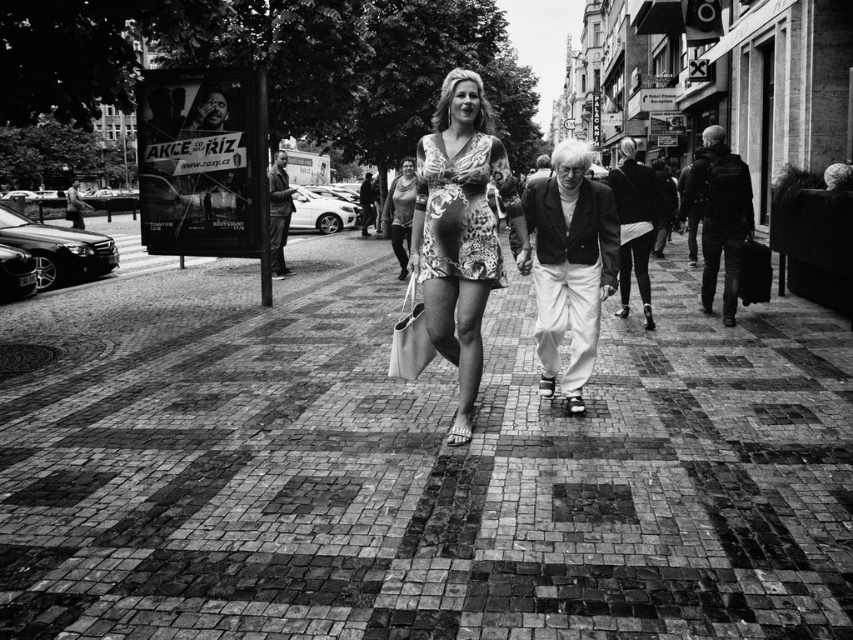
Is white cotton pants at center closer to the viewer compared to leopard print dress at center?

No, it is behind leopard print dress at center.

Who is lower down, white cotton pants at center or leopard print dress at center?

leopard print dress at center is below.

Which is behind, point (614, 282) or point (486, 200)?

The point (614, 282) is more distant.

Find the location of `white cotton pants at center`. white cotton pants at center is located at coordinates (570, 264).

Can you confirm if brick pavement at center is positioned to the right of matte beige fabric shopping bag at center?

In fact, brick pavement at center is to the left of matte beige fabric shopping bag at center.

Is brick pavement at center wider than matte beige fabric shopping bag at center?

Yes.

You are a GUI agent. You are given a task and a screenshot of the screen. Output one action in this format:
    pyautogui.click(x=<x>, y=<y>)
    Task: Click on the brick pavement at center
    The width and height of the screenshot is (853, 640).
    Given the screenshot: What is the action you would take?
    pyautogui.click(x=412, y=465)

Identify the location of brick pavement at center. (412, 465).

Does white cotton pants at center appear on the left side of matte gray tank top at center?

In fact, white cotton pants at center is to the right of matte gray tank top at center.

Which is above, white cotton pants at center or matte gray tank top at center?

Positioned higher is matte gray tank top at center.

What do you see at coordinates (570, 264) in the screenshot?
I see `white cotton pants at center` at bounding box center [570, 264].

This screenshot has height=640, width=853. In order to click on white cotton pants at center in this screenshot , I will do `click(570, 264)`.